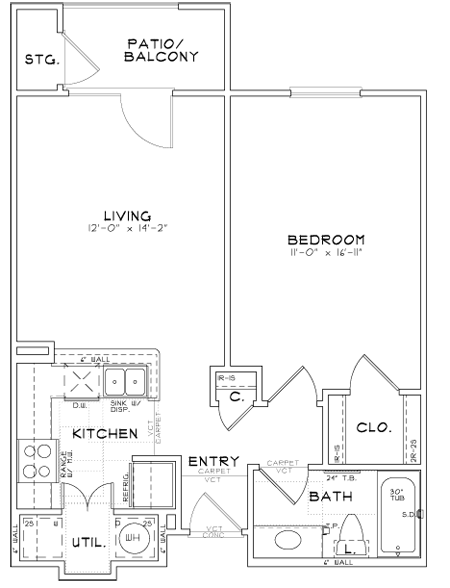
Show me where where you store  your clothes are located in the image. Your answer should be formatted as a list of tuples, i.e. [(x1, y1), (x2, y2), ...], where each tuple contains the x and y coordinates of a point satisfying the conditions above.

[(381, 440)]